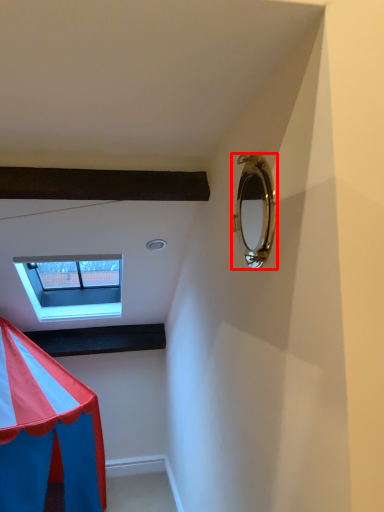
Question: From the image's perspective, considering the relative positions of mirror (annotated by the red box) and window in the image provided, where is mirror (annotated by the red box) located with respect to the staircase?

Choices:
 (A) above
 (B) below

Answer: (A)